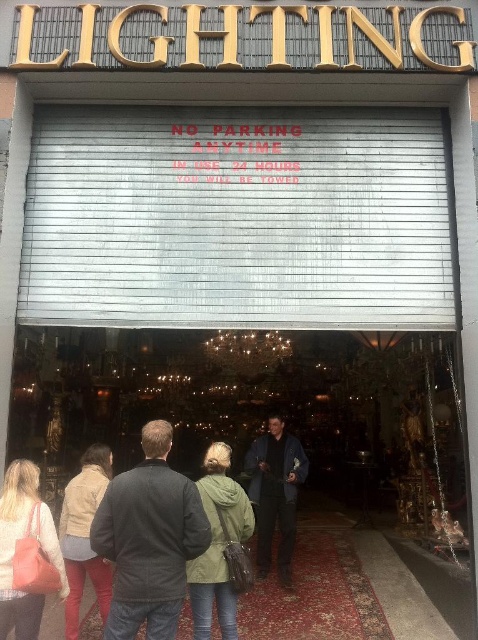
You are standing in front of the lighting store and want to take a photo of the entrance. You notice two points marked on the security gate at coordinates point (217,467) and point (279,481). Which point should you focus on to ensure it appears larger in your photo?

Point (217,467) is closer to the camera than point (279,481), so focusing on it will make it appear larger in the photo.